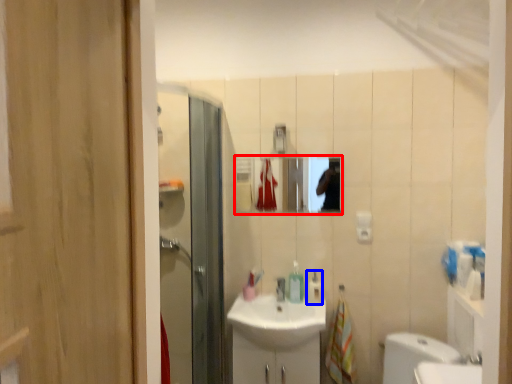
Question: Which point is closer to the camera, mirror (highlighted by a red box) or soap dispenser (highlighted by a blue box)?

Choices:
 (A) mirror
 (B) soap dispenser

Answer: (B)